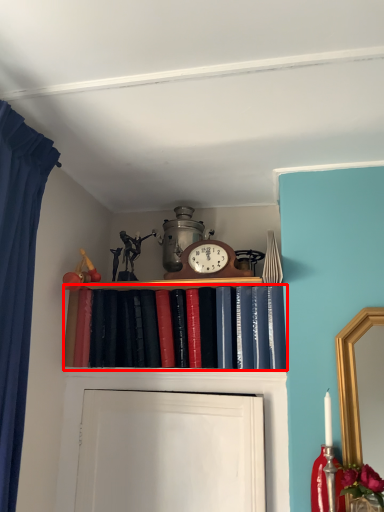
Question: Considering the relative positions of book (annotated by the red box) and alarm clock in the image provided, where is book (annotated by the red box) located with respect to the staircase?

Choices:
 (A) right
 (B) left

Answer: (B)